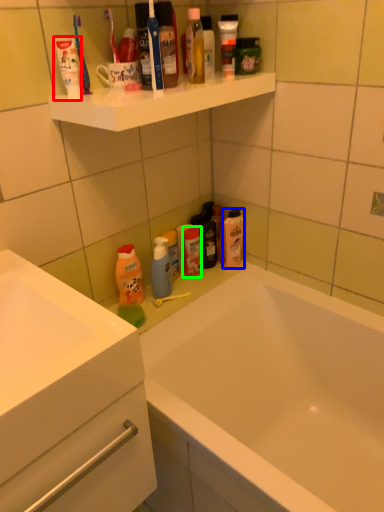
Question: Based on their relative distances, which object is nearer to toothpaste (highlighted by a red box)? Choose from mouthwash (highlighted by a blue box) and toiletry (highlighted by a green box).

Choices:
 (A) mouthwash
 (B) toiletry

Answer: (B)